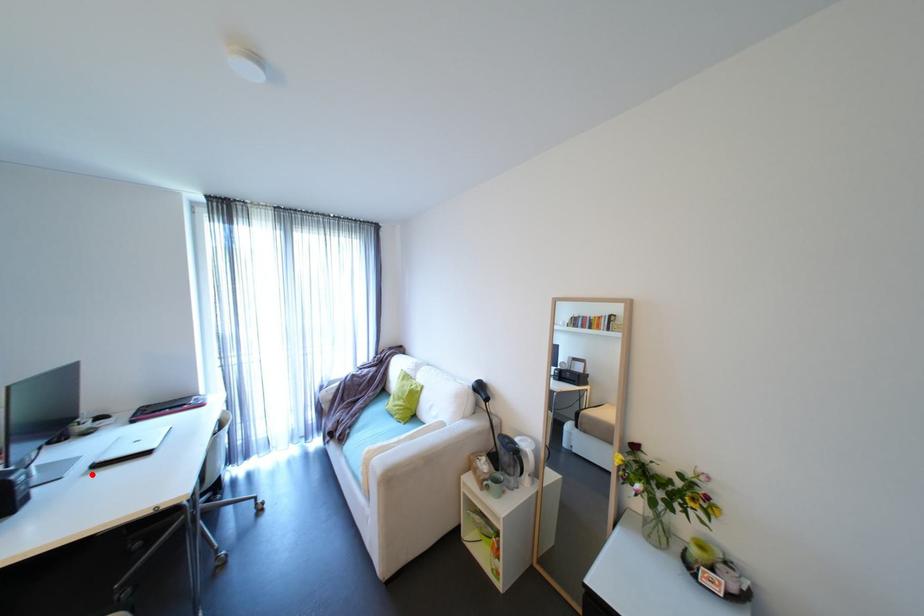
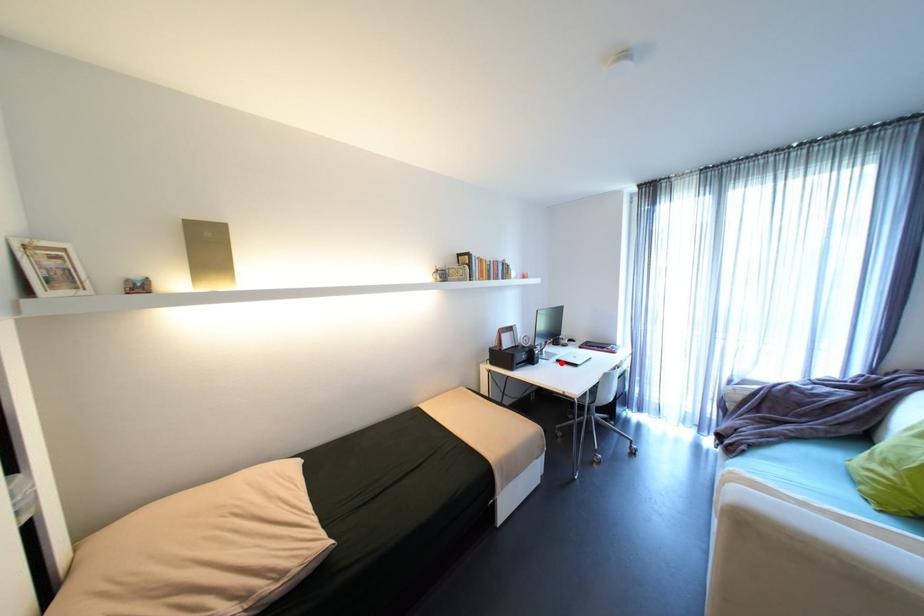
I am providing you with two images of the same scene from different viewpoints. A red point is marked on the first image and another point is marked on the second image. Are the points marked in image1 and image2 representing the same 3D position?

Yes